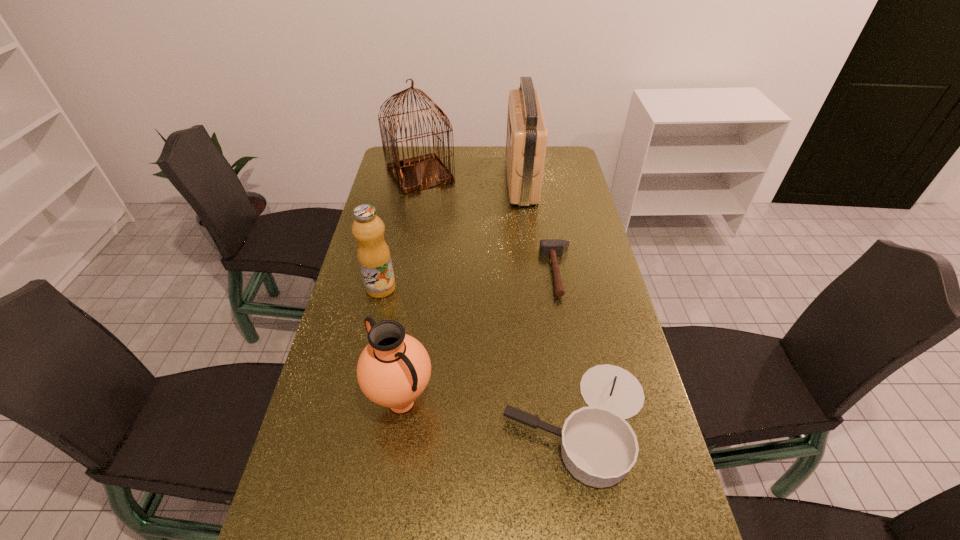
Locate an element on the screen. The height and width of the screenshot is (540, 960). free space between the fruit juice and the second shortest object is located at coordinates (479, 355).

Locate an element on the screen. Image resolution: width=960 pixels, height=540 pixels. free spot between the birdcage and the fifth tallest object is located at coordinates (499, 298).

Identify the location of empty space that is in between the saucepan and the pitcher. (490, 412).

What are the coordinates of `free spot between the fifth tallest object and the birdcage` in the screenshot? It's located at (499, 298).

Where is `free spot between the fruit juice and the radio receiver`? Image resolution: width=960 pixels, height=540 pixels. free spot between the fruit juice and the radio receiver is located at coordinates (451, 234).

The image size is (960, 540). Find the location of `vacant space that's between the radio receiver and the hammer`. vacant space that's between the radio receiver and the hammer is located at coordinates (540, 226).

Where is `vacant space that's between the shortest object and the pitcher`? The height and width of the screenshot is (540, 960). vacant space that's between the shortest object and the pitcher is located at coordinates (480, 337).

Image resolution: width=960 pixels, height=540 pixels. Find the location of `object identified as the second closest to the fruit juice`. object identified as the second closest to the fruit juice is located at coordinates (598, 447).

At what (x,y) coordinates should I click in order to perform the action: click on object that stands as the fifth closest to the fifth tallest object. Please return your answer as a coordinate pair (x, y). This screenshot has height=540, width=960. Looking at the image, I should click on (413, 174).

This screenshot has width=960, height=540. Find the location of `vacant space that satisfies the following two spatial constraints: 1. on the striking surface of the hammer; 2. on the front side of the pitcher`. vacant space that satisfies the following two spatial constraints: 1. on the striking surface of the hammer; 2. on the front side of the pitcher is located at coordinates (582, 402).